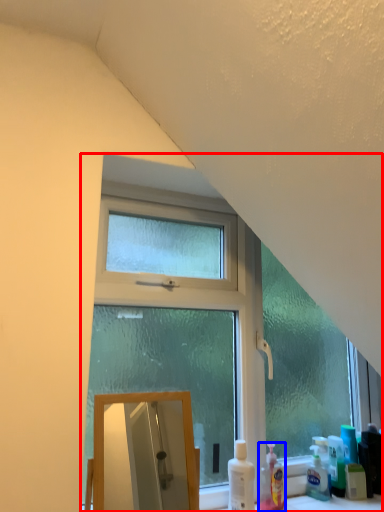
Question: Which point is closer to the camera, window (highlighted by a red box) or cleaning product (highlighted by a blue box)?

Choices:
 (A) window
 (B) cleaning product

Answer: (A)